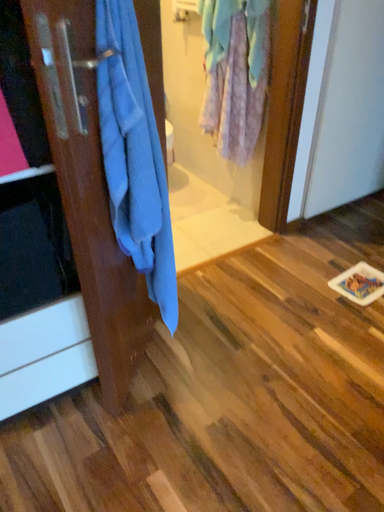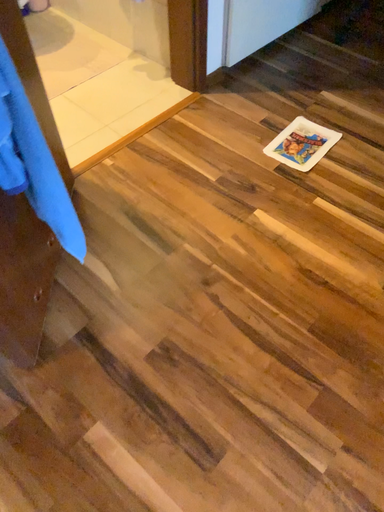
Question: How did the camera likely rotate when shooting the video?

Choices:
 (A) rotated right
 (B) rotated left

Answer: (A)